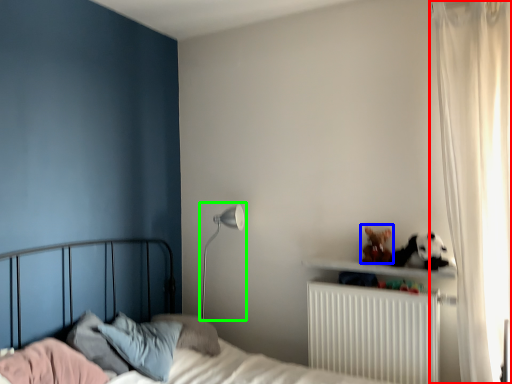
Question: Which object is positioned closest to curtain (highlighted by a red box)? Select from stuff (highlighted by a blue box) and table lamp (highlighted by a green box).

Choices:
 (A) stuff
 (B) table lamp

Answer: (A)